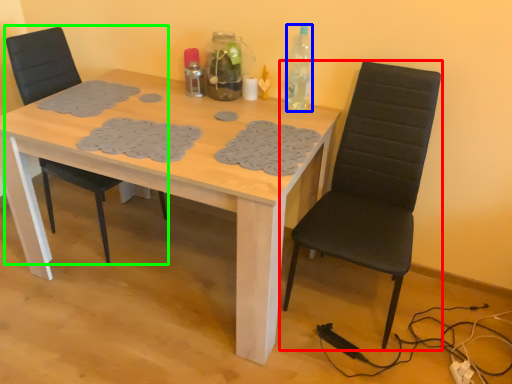
Question: Estimate the real-world distances between objects in this image. Which object is closer to chair (highlighted by a red box), bottle (highlighted by a blue box) or chair (highlighted by a green box)?

Choices:
 (A) bottle
 (B) chair

Answer: (A)